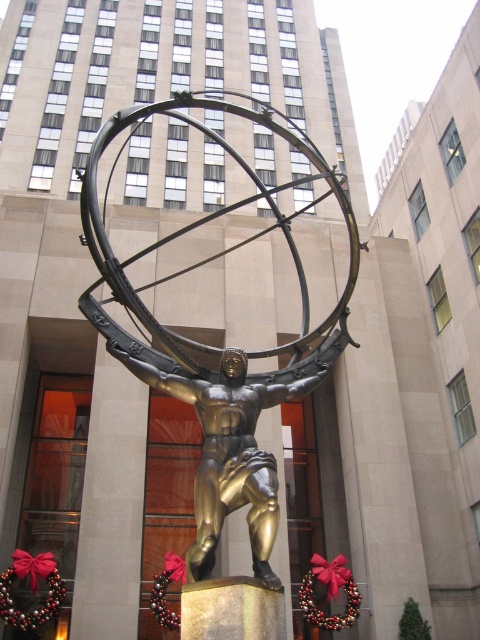
Which is in front, point (160, 356) or point (238, 392)?

Positioned in front is point (238, 392).

Does gold polished statue at center appear under gold metallic statue at center?

Actually, gold polished statue at center is above gold metallic statue at center.

In order to click on gold polished statue at center in this screenshot , I will do `click(206, 262)`.